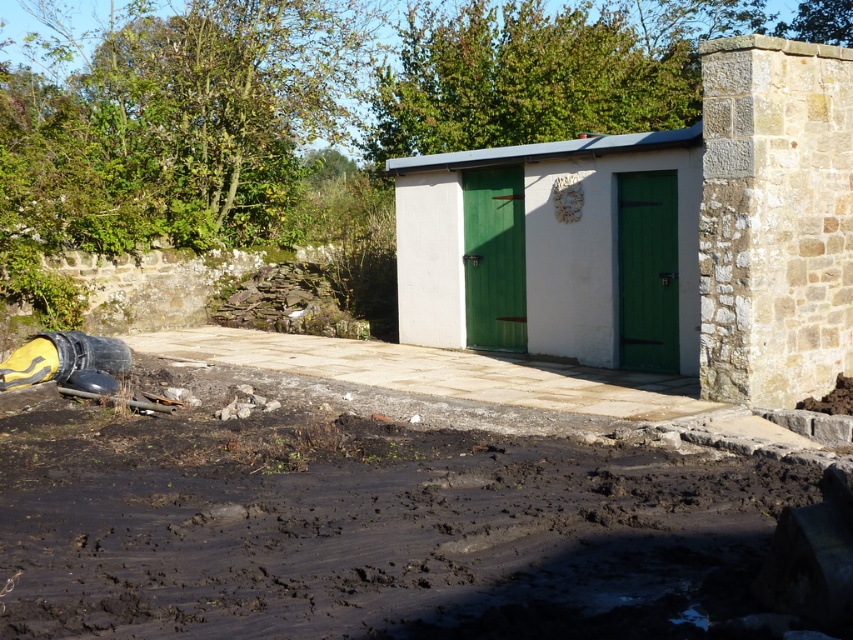
Question: Which point is closer to the camera taking this photo?

Choices:
 (A) (660, 296)
 (B) (416, 582)

Answer: (B)

Question: Estimate the real-world distances between objects in this image. Which object is closer to the damp brown dirt at lower center?

Choices:
 (A) white wood shed at center
 (B) white painted wood shed at center

Answer: (B)

Question: Which object appears farthest from the camera in this image?

Choices:
 (A) damp brown dirt at lower center
 (B) white wood shed at center
 (C) white painted wood shed at center

Answer: (B)

Question: Does damp brown dirt at lower center have a larger size compared to white wood shed at center?

Choices:
 (A) yes
 (B) no

Answer: (B)

Question: Does white painted wood shed at center appear over white wood shed at center?

Choices:
 (A) yes
 (B) no

Answer: (A)

Question: Does damp brown dirt at lower center have a lesser width compared to white wood shed at center?

Choices:
 (A) no
 (B) yes

Answer: (B)